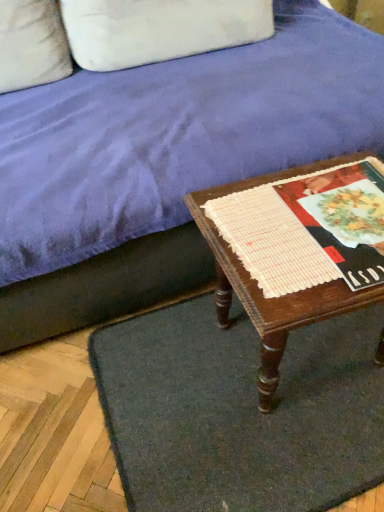
Question: Is white fabric pillow at upper left taller or shorter than dark gray carpet at lower center?

Choices:
 (A) tall
 (B) short

Answer: (A)

Question: Is white fabric pillow at upper left inside the boundaries of dark gray carpet at lower center, or outside?

Choices:
 (A) outside
 (B) inside

Answer: (A)

Question: Based on their relative distances, which object is nearer to the velvet purple couch at upper center?

Choices:
 (A) white fabric pillow at upper left
 (B) white woven placemat at center
 (C) wooden table at lower right
 (D) dark gray carpet at lower center

Answer: (C)

Question: Which object is positioned closest to the velvet purple couch at upper center?

Choices:
 (A) white woven placemat at center
 (B) wooden table at lower right
 (C) dark gray carpet at lower center
 (D) white fabric pillow at upper left

Answer: (B)